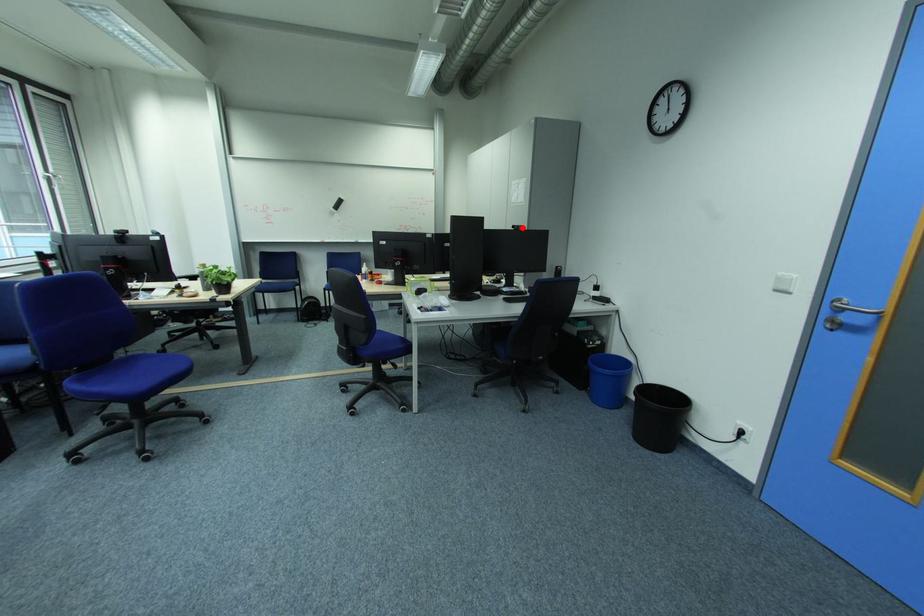
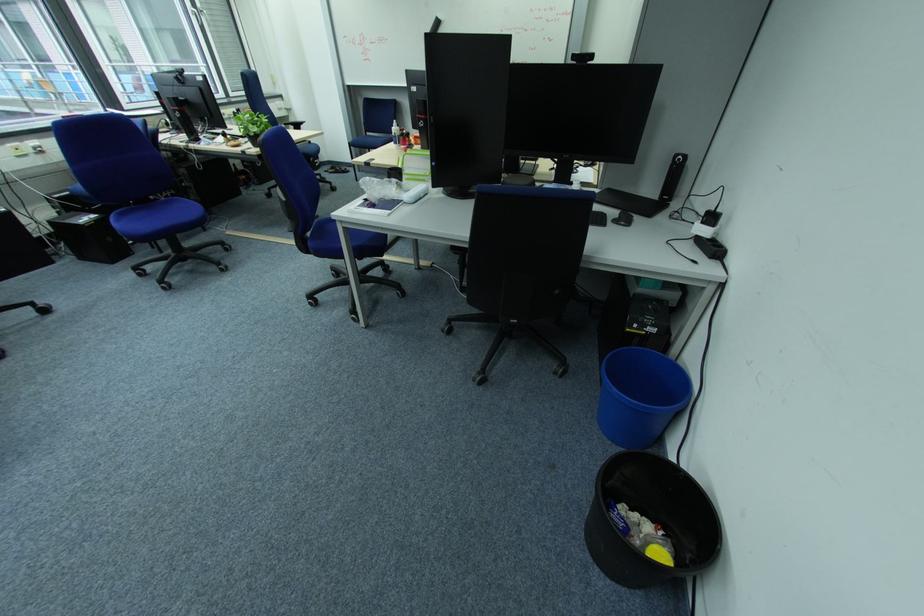
The point at the highlighted location is marked in the first image. Where is the corresponding point in the second image?

(581, 57)